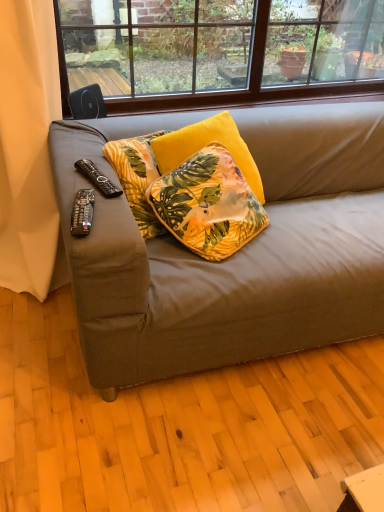
Question: Are black plastic remote control at lower left, the second remote control viewed from the back, and beige fabric curtain at left located far from each other?

Choices:
 (A) yes
 (B) no

Answer: (B)

Question: Is black plastic remote control at lower left, which is the 1th remote control in front-to-back order, at the right side of beige fabric curtain at left?

Choices:
 (A) yes
 (B) no

Answer: (A)

Question: Does black plastic remote control at lower left, which is the 1th remote control in front-to-back order, come in front of beige fabric curtain at left?

Choices:
 (A) yes
 (B) no

Answer: (A)

Question: Is black plastic remote control at lower left, the second remote control viewed from the back, with beige fabric curtain at left?

Choices:
 (A) yes
 (B) no

Answer: (B)

Question: Is black plastic remote control at lower left, which is counted as the second remote control, starting from the top, aimed at beige fabric curtain at left?

Choices:
 (A) no
 (B) yes

Answer: (A)

Question: Would you say black plastic remote control at lower left, which is counted as the second remote control, starting from the top, is to the left or to the right of beige fabric curtain at left in the picture?

Choices:
 (A) left
 (B) right

Answer: (B)

Question: From a real-world perspective, is black plastic remote control at lower left, which is counted as the second remote control, starting from the top, positioned above or below beige fabric curtain at left?

Choices:
 (A) above
 (B) below

Answer: (A)

Question: In terms of height, does black plastic remote control at lower left, the second remote control viewed from the back, look taller or shorter compared to beige fabric curtain at left?

Choices:
 (A) short
 (B) tall

Answer: (A)

Question: Is black plastic remote control at lower left, the first remote control from the bottom, bigger or smaller than beige fabric curtain at left?

Choices:
 (A) big
 (B) small

Answer: (B)

Question: In terms of height, does black plastic remote at left, which ranks as the first remote control in back-to-front order, look taller or shorter compared to beige fabric curtain at left?

Choices:
 (A) short
 (B) tall

Answer: (A)

Question: From the image's perspective, is black plastic remote at left, which appears as the 2th remote control when ordered from the bottom, above or below beige fabric curtain at left?

Choices:
 (A) above
 (B) below

Answer: (B)

Question: Looking at their shapes, would you say black plastic remote at left, placed as the second remote control when sorted from front to back, is wider or thinner than beige fabric curtain at left?

Choices:
 (A) wide
 (B) thin

Answer: (B)

Question: Based on their sizes in the image, would you say black plastic remote at left, placed as the second remote control when sorted from front to back, is bigger or smaller than beige fabric curtain at left?

Choices:
 (A) big
 (B) small

Answer: (B)

Question: Based on their sizes in the image, would you say beige fabric curtain at left is bigger or smaller than black plastic remote control at lower left, the first remote control from the bottom?

Choices:
 (A) big
 (B) small

Answer: (A)

Question: Considering their positions, is beige fabric curtain at left located in front of or behind black plastic remote control at lower left, the first remote control from the bottom?

Choices:
 (A) front
 (B) behind

Answer: (B)